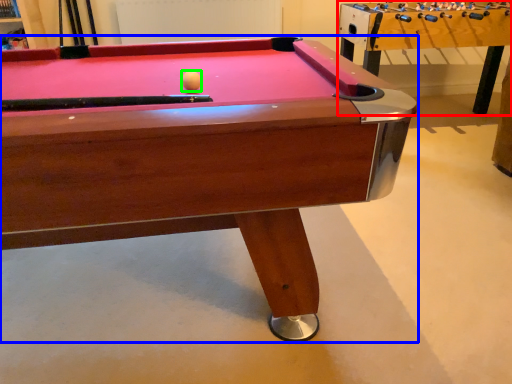
Question: Which object is the closest to the table (highlighted by a red box)? Choose among these: billiard table (highlighted by a blue box) or ball (highlighted by a green box).

Choices:
 (A) billiard table
 (B) ball

Answer: (A)